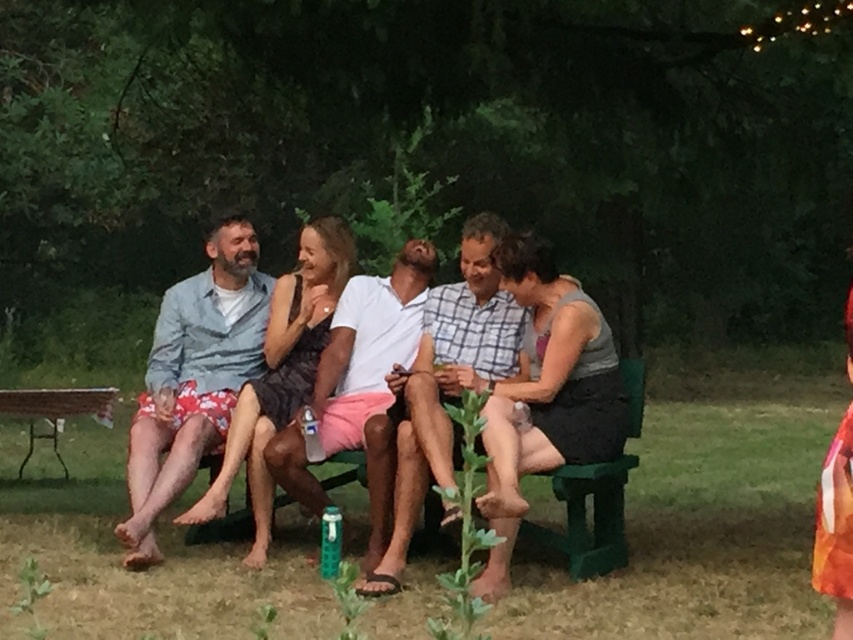
You are standing in a park and see a group of five people sitting on a green bench. There is a point at coordinates (x=505, y=381). What object is located at that point?

The point at coordinates (x=505, y=381) corresponds to the matte white shirt at center.

You are standing in front of the bench where the group is sitting. You notice two points marked on the bench. One is at coordinates point (408, 499) and the other at point (361, 352). Which point is closer to you?

Point (408, 499) is closer to you than point (361, 352).